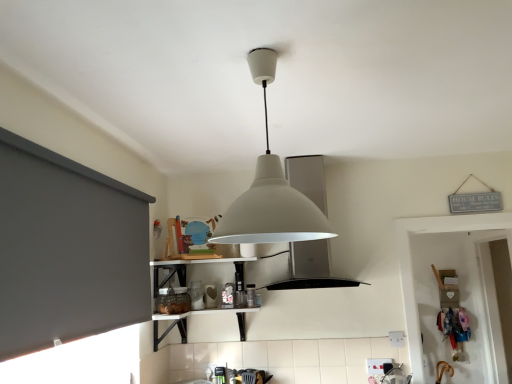
Where is `free spot above white matte lampshade at center (from a real-world perspective)`? free spot above white matte lampshade at center (from a real-world perspective) is located at coordinates (270, 46).